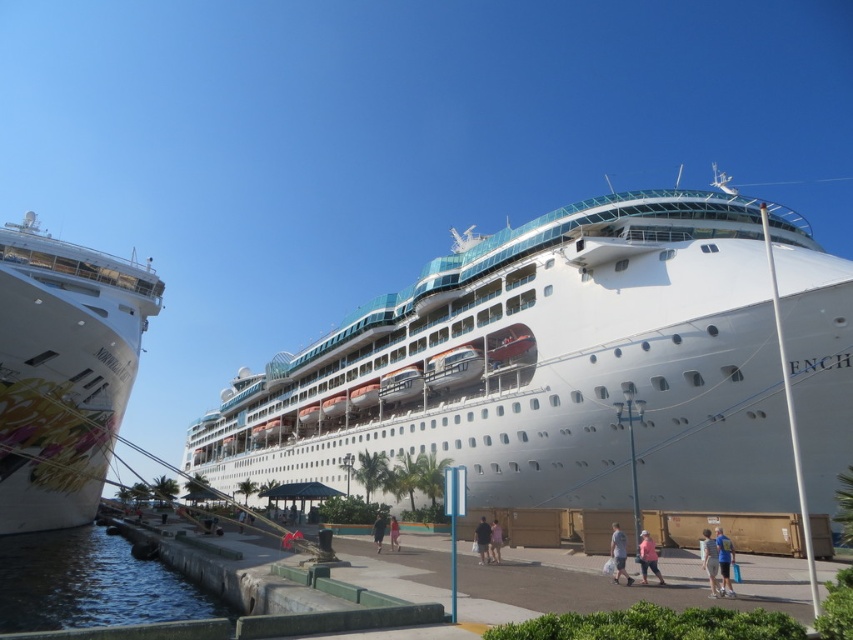
Where is `light blue jeans at center`? Image resolution: width=853 pixels, height=640 pixels. light blue jeans at center is located at coordinates (482, 540).

Who is more distant from viewer, (x=485, y=557) or (x=397, y=538)?

The point (x=397, y=538) is more distant.

Find the location of a particular element. light blue jeans at center is located at coordinates (482, 540).

Is point (70, 550) positioned before point (718, 589)?

That is False.

Is clear water at dock left below light blue denim shorts at lower right?

Indeed, clear water at dock left is positioned under light blue denim shorts at lower right.

Between point (6, 621) and point (711, 592), which one is positioned behind?

Point (6, 621)

The width and height of the screenshot is (853, 640). Identify the location of clear water at dock left. (91, 582).

Does light blue denim shorts at lower right lie in front of pink fabric dress at center?

That is True.

Is the position of light blue denim shorts at lower right more distant than that of pink fabric dress at center?

No, light blue denim shorts at lower right is closer to the viewer.

Which is in front, point (709, 576) or point (392, 522)?

Positioned in front is point (709, 576).

At what (x,y) coordinates should I click in order to perform the action: click on light blue denim shorts at lower right. Please return your answer as a coordinate pair (x, y). The height and width of the screenshot is (640, 853). Looking at the image, I should click on (711, 561).